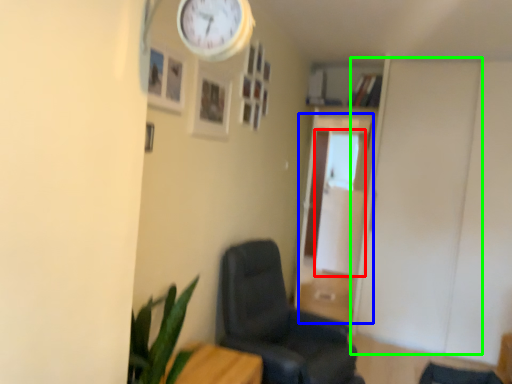
Question: Which object is positioned closest to glass door (highlighted by a red box)? Select from glass door (highlighted by a blue box) and door (highlighted by a green box).

Choices:
 (A) glass door
 (B) door

Answer: (A)